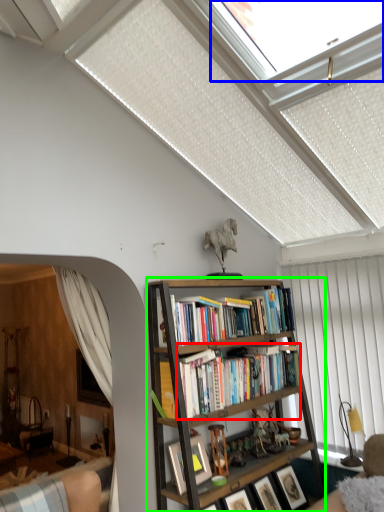
Question: Which object is the closest to the book (highlighted by a red box)? Choose among these: window (highlighted by a blue box) or bookcase (highlighted by a green box).

Choices:
 (A) window
 (B) bookcase

Answer: (B)